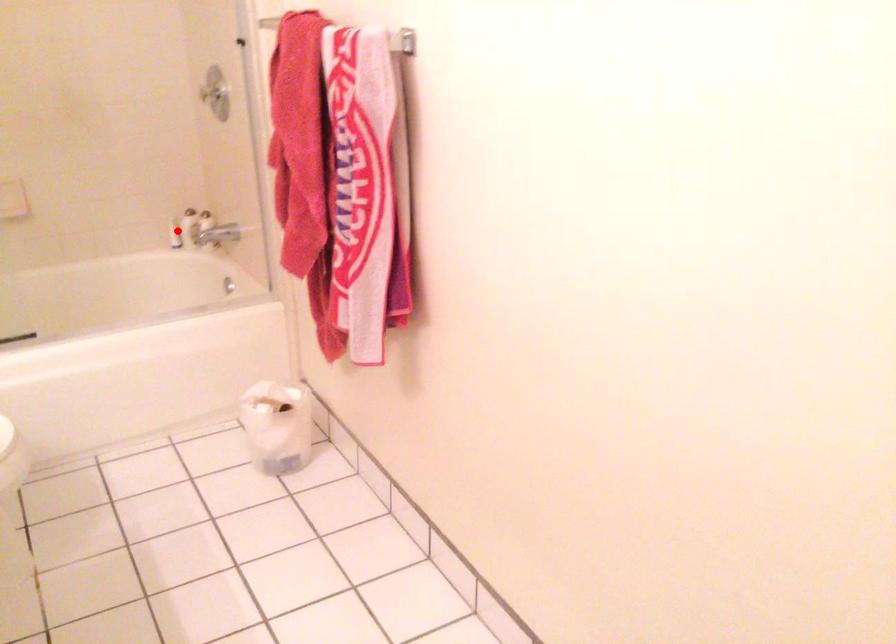
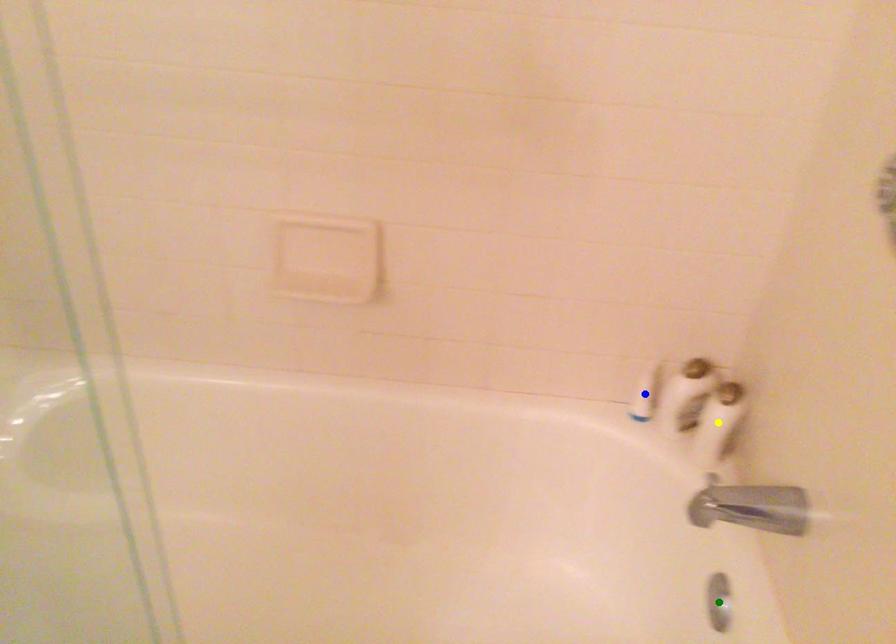
Question: I am providing you with two images of the same scene from different viewpoints. A red point is marked on the first image. You are given multiple points on the second image. Can you choose the point in image 2 that corresponds to the point in image 1?

Choices:
 (A) blue point
 (B) green point
 (C) yellow point

Answer: (A)